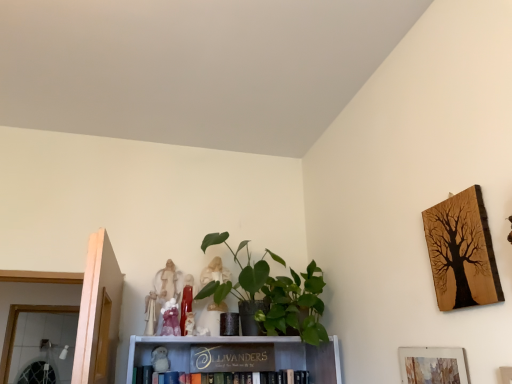
Question: Would you say watercolor paper picture frame at lower right, the 1th picture frame ordered from the bottom, is to the left or to the right of matte white figurine at center, placed as the 1th toy when sorted from right to left, in the picture?

Choices:
 (A) right
 (B) left

Answer: (A)

Question: Is watercolor paper picture frame at lower right, which ranks as the second picture frame in top-to-bottom order, wider or thinner than matte white figurine at center, placed as the sixth toy when sorted from left to right?

Choices:
 (A) thin
 (B) wide

Answer: (A)

Question: Which of these objects is positioned closest to the matte pink porcelain at upper center, positioned as the 4th toy in right-to-left order?

Choices:
 (A) white plush toy at center, positioned as the second toy in left-to-right order
 (B) matte white figurine at center, which is the 3th toy in right-to-left order
 (C) watercolor paper picture frame at lower right, the 1th picture frame ordered from the bottom
 (D) wooden sign at center, the first book positioned from the bottom
 (E) gold metallic sign at center, the 2th book in the bottom-to-top sequence

Answer: (B)

Question: Estimate the real-world distances between objects in this image. Which object is farther from the watercolor paper picture frame at lower right, the 1th picture frame ordered from the bottom?

Choices:
 (A) matte white figurine at center, placed as the 1th toy when sorted from right to left
 (B) white plush toy at center, positioned as the second toy in left-to-right order
 (C) wooden sign at center, the first book positioned from the bottom
 (D) wooden tree art at upper right, arranged as the first picture frame when viewed from the top
 (E) white fabric angel at upper center, arranged as the 1th toy when viewed from the left

Answer: (E)